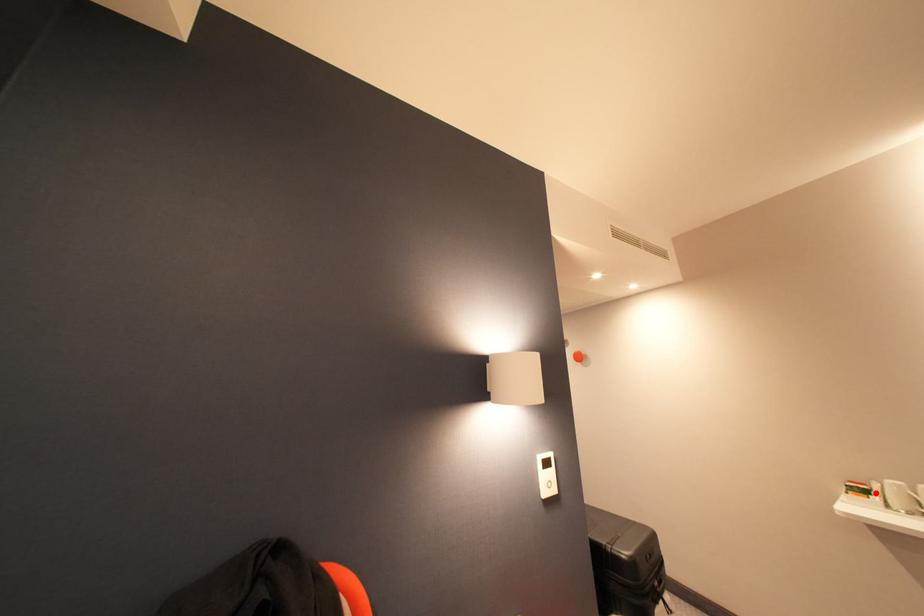
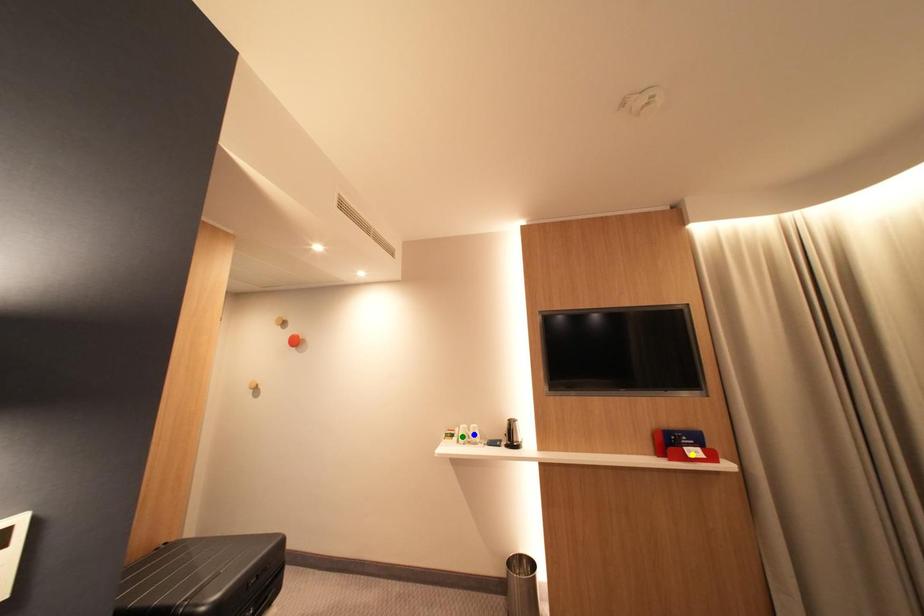
Question: I am providing you with two images of the same scene from different viewpoints. A red point is marked on the first image. You are given multiple points on the second image. Which point in image 2 represents the same 3d spot as the red point in image 1?

Choices:
 (A) blue point
 (B) yellow point
 (C) green point

Answer: (C)